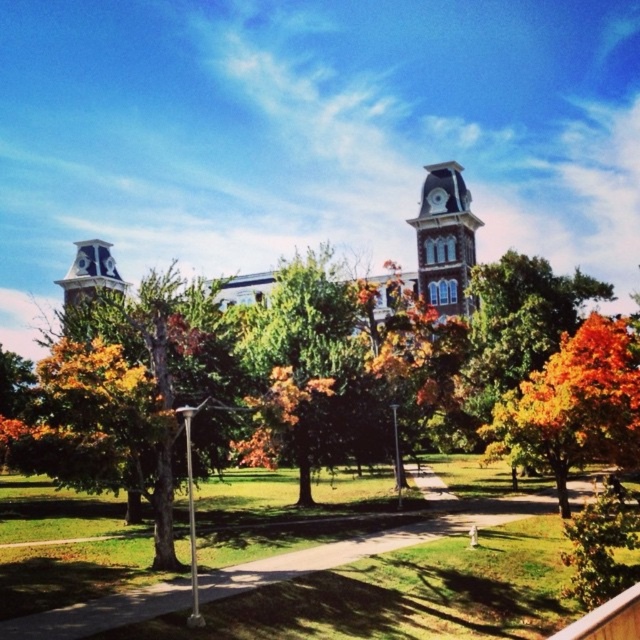
Is orange autumn leaves at center above brown stone clock tower at upper center?

No.

The image size is (640, 640). In order to click on orange autumn leaves at center in this screenshot , I will do `click(573, 404)`.

The height and width of the screenshot is (640, 640). Identify the location of orange autumn leaves at center. (573, 404).

Is green leafy tree at center above orange leafy tree at center?

No.

Can you confirm if green leafy tree at center is positioned to the right of orange leafy tree at center?

In fact, green leafy tree at center is to the left of orange leafy tree at center.

Locate an element on the screen. The width and height of the screenshot is (640, 640). green leafy tree at center is located at coordinates (301, 365).

Is green grass at lower center to the left of orange leafy tree at center from the viewer's perspective?

Yes, green grass at lower center is to the left of orange leafy tree at center.

Between point (259, 584) and point (506, 294), which one is positioned behind?

The point (506, 294) is behind.

The image size is (640, 640). I want to click on green grass at lower center, so click(x=340, y=552).